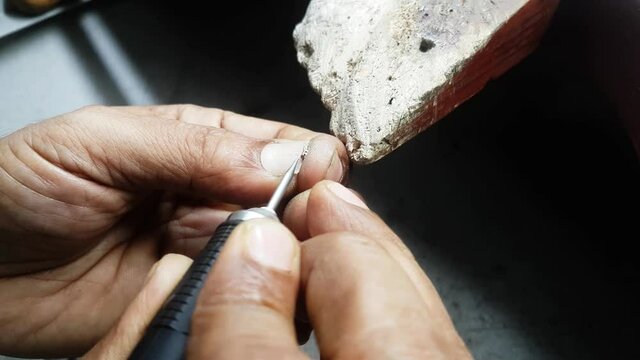
Where is `handle`? Image resolution: width=640 pixels, height=360 pixels. handle is located at coordinates point(173,319).